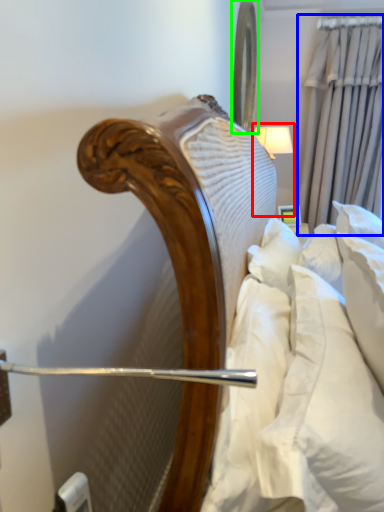
Question: Based on their relative distances, which object is nearer to bedside lamp (highlighted by a red box)? Choose from curtain (highlighted by a blue box) and mirror (highlighted by a green box).

Choices:
 (A) curtain
 (B) mirror

Answer: (B)